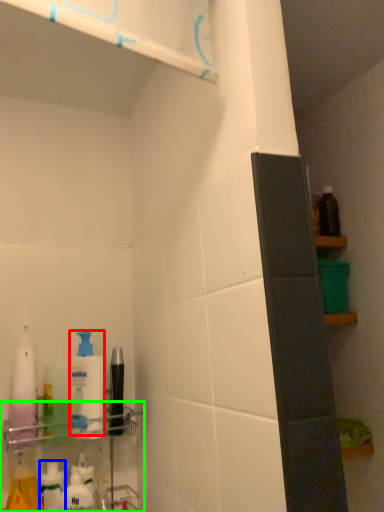
Question: Estimate the real-world distances between objects in this image. Which object is closer to cleaning product (highlighted by a red box), toiletry (highlighted by a blue box) or shelf (highlighted by a green box)?

Choices:
 (A) toiletry
 (B) shelf

Answer: (B)